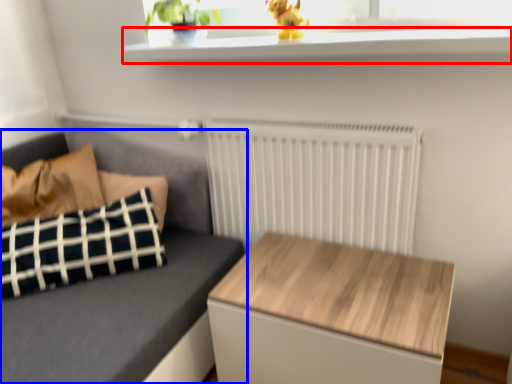
Question: Among these objects, which one is nearest to the camera, window sill (highlighted by a red box) or studio couch (highlighted by a blue box)?

Choices:
 (A) window sill
 (B) studio couch

Answer: (A)